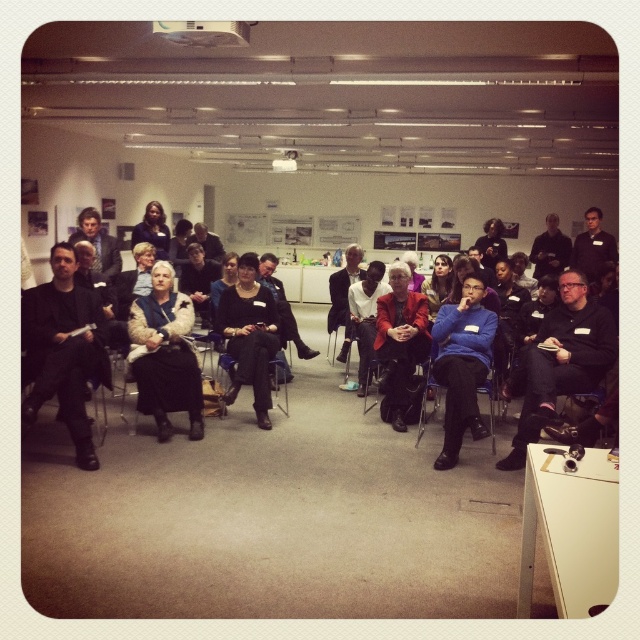
You are standing at the entrance of the conference room and see the matte red jacket at center. If you want to reach it within 10 seconds, what is the minimum speed you need to walk at?

The matte red jacket at center is 5.01 meters away from the viewer. To reach it within 10 seconds, you need to walk at a minimum speed of 0.501 meters per second.

You are attending a meeting in this conference room and notice the matte red jacket at center and the black fabric chair at center. Which object is taller?

The matte red jacket at center is much taller than the black fabric chair at center.

You are standing in the conference room and want to walk from your current position to the presentation area. There are two points marked in the room, point (x=29, y=328) and point (x=272, y=333). Which point should you walk towards if you want to reach the presentation area first?

You should walk towards point (x=29, y=328) because it is in front of point (x=272, y=333), meaning it is closer to the presentation area.